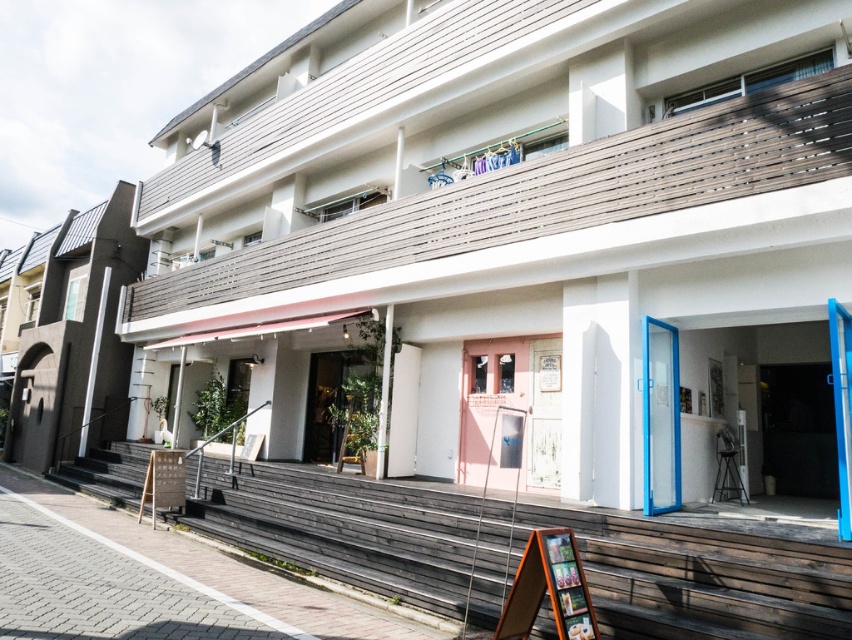
You are standing at the point with coordinates (x=68, y=332) in the image. What object are you facing?

The point at (x=68, y=332) corresponds to the dark gray concrete building at left, so you are facing the dark gray concrete building at left.

You are standing at the entrance of the building and want to walk towards the pink door. There are two points marked on the path. Which point, point [519,305] or point [612,556], is closer to you as you face the building?

Point [612,556] is closer to you because it is in front of point [519,305].